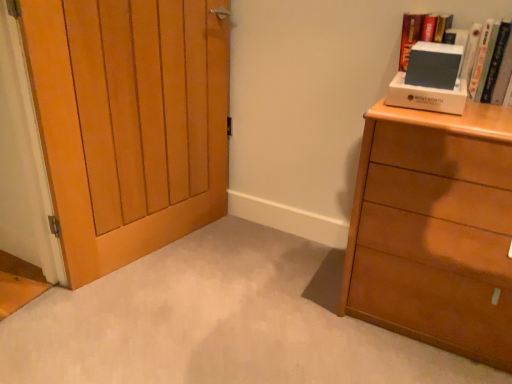
What do you see at coordinates (130, 122) in the screenshot?
I see `wooden door at left` at bounding box center [130, 122].

What are the coordinates of `wooden door at left` in the screenshot? It's located at (130, 122).

The image size is (512, 384). I want to click on wooden door at left, so click(x=130, y=122).